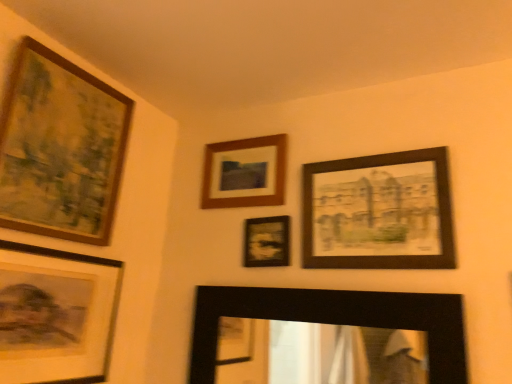
Find the location of a particular element. The height and width of the screenshot is (384, 512). black matte mirror at lower center, the 2th picture frame when ordered from right to left is located at coordinates (334, 320).

In order to click on wooden framed print at upper right, which appears as the sixth picture frame when viewed from the left in this screenshot , I will do `click(379, 212)`.

Identify the location of black matte mirror at lower center, which appears as the 5th picture frame when viewed from the left. The width and height of the screenshot is (512, 384). click(x=334, y=320).

Looking at this image, measure the distance between wooden-framed painting at upper left, the 6th picture frame from the right, and matte black picture frame at center, placed as the third picture frame when sorted from right to left.

wooden-framed painting at upper left, the 6th picture frame from the right, and matte black picture frame at center, placed as the third picture frame when sorted from right to left, are 64.95 centimeters apart from each other.

In the image, is wooden-framed painting at upper left, the 6th picture frame from the right, on the left side or the right side of matte black picture frame at center, placed as the third picture frame when sorted from right to left?

wooden-framed painting at upper left, the 6th picture frame from the right, is positioned on matte black picture frame at center, placed as the third picture frame when sorted from right to left,'s left side.

Based on their sizes in the image, would you say wooden-framed painting at upper left, the 6th picture frame from the right, is bigger or smaller than matte black picture frame at center, placed as the third picture frame when sorted from right to left?

wooden-framed painting at upper left, the 6th picture frame from the right, is bigger than matte black picture frame at center, placed as the third picture frame when sorted from right to left.

Considering the relative sizes of wooden-framed painting at upper left, the 6th picture frame from the right, and matte black picture frame at center, positioned as the fourth picture frame in left-to-right order, in the image provided, is wooden-framed painting at upper left, the 6th picture frame from the right, shorter than matte black picture frame at center, positioned as the fourth picture frame in left-to-right order,?

Incorrect, the height of wooden-framed painting at upper left, the 6th picture frame from the right, does not fall short of that of matte black picture frame at center, positioned as the fourth picture frame in left-to-right order.

In terms of width, does black matte mirror at lower center, the 2th picture frame when ordered from right to left, look wider or thinner when compared to wooden framed print at upper right, arranged as the 1th picture frame when viewed from the right?

black matte mirror at lower center, the 2th picture frame when ordered from right to left, is wider than wooden framed print at upper right, arranged as the 1th picture frame when viewed from the right.

Looking at this image, can you tell me how much black matte mirror at lower center, which appears as the 5th picture frame when viewed from the left, and wooden framed print at upper right, which appears as the sixth picture frame when viewed from the left, differ in facing direction?

There is a 0.0134-degree angle between the facing directions of black matte mirror at lower center, which appears as the 5th picture frame when viewed from the left, and wooden framed print at upper right, which appears as the sixth picture frame when viewed from the left.

I want to click on the 3rd picture frame below the wooden framed print at upper right, arranged as the 1th picture frame when viewed from the right (from the image's perspective), so click(334, 320).

Is black matte mirror at lower center, the 2th picture frame when ordered from right to left, smaller than wooden framed print at upper right, which appears as the sixth picture frame when viewed from the left?

Actually, black matte mirror at lower center, the 2th picture frame when ordered from right to left, might be larger than wooden framed print at upper right, which appears as the sixth picture frame when viewed from the left.

From their relative heights in the image, would you say wooden framed print at upper right, which appears as the sixth picture frame when viewed from the left, is taller or shorter than matte black picture frame at lower left, which appears as the 5th picture frame when viewed from the right?

In the image, wooden framed print at upper right, which appears as the sixth picture frame when viewed from the left, appears to be shorter than matte black picture frame at lower left, which appears as the 5th picture frame when viewed from the right.

Between wooden framed print at upper right, which appears as the sixth picture frame when viewed from the left, and matte black picture frame at lower left, placed as the second picture frame when sorted from left to right, which one appears on the right side from the viewer's perspective?

wooden framed print at upper right, which appears as the sixth picture frame when viewed from the left.

I want to click on the 3rd picture frame in front of the wooden framed print at upper right, which appears as the sixth picture frame when viewed from the left, so click(x=56, y=314).

From the image's perspective, is wooden framed print at upper right, arranged as the 1th picture frame when viewed from the right, beneath matte black picture frame at lower left, which appears as the 5th picture frame when viewed from the right?

No, from the image's perspective, wooden framed print at upper right, arranged as the 1th picture frame when viewed from the right, is not beneath matte black picture frame at lower left, which appears as the 5th picture frame when viewed from the right.

Looking at this image, how distant is black matte mirror at lower center, the 2th picture frame when ordered from right to left, from wooden frame at upper center, which is the 4th picture frame in right-to-left order?

They are 17.38 inches apart.

From the image's perspective, is black matte mirror at lower center, the 2th picture frame when ordered from right to left, positioned above or below wooden frame at upper center, which is the 4th picture frame in right-to-left order?

From the image's perspective, black matte mirror at lower center, the 2th picture frame when ordered from right to left, appears below wooden frame at upper center, which is the 4th picture frame in right-to-left order.

Which of these two, black matte mirror at lower center, which appears as the 5th picture frame when viewed from the left, or wooden frame at upper center, which is the 3th picture frame in left-to-right order, is wider?

Wider between the two is black matte mirror at lower center, which appears as the 5th picture frame when viewed from the left.

Is black matte mirror at lower center, which appears as the 5th picture frame when viewed from the left, with wooden frame at upper center, which is the 3th picture frame in left-to-right order?

There is a gap between black matte mirror at lower center, which appears as the 5th picture frame when viewed from the left, and wooden frame at upper center, which is the 3th picture frame in left-to-right order.

Is matte black picture frame at center, placed as the third picture frame when sorted from right to left, oriented away from black matte mirror at lower center, the 2th picture frame when ordered from right to left?

No.

From the image's perspective, which one is positioned lower, matte black picture frame at center, placed as the third picture frame when sorted from right to left, or black matte mirror at lower center, the 2th picture frame when ordered from right to left?

black matte mirror at lower center, the 2th picture frame when ordered from right to left, is shown below in the image.

From a real-world perspective, count 2nd picture frames downward from the matte black picture frame at center, placed as the third picture frame when sorted from right to left, and point to it. Please provide its 2D coordinates.

[(334, 320)]

Can you confirm if matte black picture frame at center, placed as the third picture frame when sorted from right to left, is taller than black matte mirror at lower center, which appears as the 5th picture frame when viewed from the left?

No, matte black picture frame at center, placed as the third picture frame when sorted from right to left, is not taller than black matte mirror at lower center, which appears as the 5th picture frame when viewed from the left.

Can you confirm if wooden frame at upper center, which is the 3th picture frame in left-to-right order, is positioned to the left of wooden-framed painting at upper left, arranged as the 1th picture frame when viewed from the left?

In fact, wooden frame at upper center, which is the 3th picture frame in left-to-right order, is to the right of wooden-framed painting at upper left, arranged as the 1th picture frame when viewed from the left.

Can you tell me how much wooden frame at upper center, which is the 3th picture frame in left-to-right order, and wooden-framed painting at upper left, the 6th picture frame from the right, differ in facing direction?

90.1 degrees separate the facing orientations of wooden frame at upper center, which is the 3th picture frame in left-to-right order, and wooden-framed painting at upper left, the 6th picture frame from the right.

Is wooden frame at upper center, which is the 4th picture frame in right-to-left order, oriented towards wooden-framed painting at upper left, arranged as the 1th picture frame when viewed from the left?

Yes.

From the image's perspective, which is below, wooden frame at upper center, which is the 3th picture frame in left-to-right order, or wooden-framed painting at upper left, arranged as the 1th picture frame when viewed from the left?

wooden frame at upper center, which is the 3th picture frame in left-to-right order, is shown below in the image.

Looking at this image, could you tell me if black matte mirror at lower center, the 2th picture frame when ordered from right to left, is facing matte black picture frame at lower left, placed as the second picture frame when sorted from left to right?

Yes, black matte mirror at lower center, the 2th picture frame when ordered from right to left, is turned towards matte black picture frame at lower left, placed as the second picture frame when sorted from left to right.

How many degrees apart are the facing directions of black matte mirror at lower center, which appears as the 5th picture frame when viewed from the left, and matte black picture frame at lower left, placed as the second picture frame when sorted from left to right?

They differ by 90 degrees in their facing directions.

Find the location of a particular element. The width and height of the screenshot is (512, 384). picture frame that is under the matte black picture frame at lower left, placed as the second picture frame when sorted from left to right (from a real-world perspective) is located at coordinates (334, 320).

Identify the location of the 2nd picture frame in front when counting from the matte black picture frame at center, placed as the third picture frame when sorted from right to left. The height and width of the screenshot is (384, 512). (60, 148).

From the image's perspective, starting from the black matte mirror at lower center, which appears as the 5th picture frame when viewed from the left, which picture frame is the 3rd one above? Please provide its 2D coordinates.

[(379, 212)]

Consider the image. Which object lies nearer to the anchor point matte black picture frame at lower left, placed as the second picture frame when sorted from left to right, matte black picture frame at center, placed as the third picture frame when sorted from right to left, or wooden frame at upper center, which is the 3th picture frame in left-to-right order?

matte black picture frame at center, placed as the third picture frame when sorted from right to left, lies closer to matte black picture frame at lower left, placed as the second picture frame when sorted from left to right, than the other object.

From the image, which object appears to be farther from wooden framed print at upper right, arranged as the 1th picture frame when viewed from the right, wooden-framed painting at upper left, arranged as the 1th picture frame when viewed from the left, or wooden frame at upper center, which is the 4th picture frame in right-to-left order?

The object further to wooden framed print at upper right, arranged as the 1th picture frame when viewed from the right, is wooden-framed painting at upper left, arranged as the 1th picture frame when viewed from the left.

Looking at the image, which one is located closer to wooden frame at upper center, which is the 4th picture frame in right-to-left order, wooden-framed painting at upper left, the 6th picture frame from the right, or wooden framed print at upper right, which appears as the sixth picture frame when viewed from the left?

Based on the image, wooden framed print at upper right, which appears as the sixth picture frame when viewed from the left, appears to be nearer to wooden frame at upper center, which is the 4th picture frame in right-to-left order.

Considering their positions, is wooden-framed painting at upper left, arranged as the 1th picture frame when viewed from the left, positioned closer to wooden frame at upper center, which is the 4th picture frame in right-to-left order, than matte black picture frame at lower left, placed as the second picture frame when sorted from left to right?

Answer: The object closer to wooden frame at upper center, which is the 4th picture frame in right-to-left order, is wooden-framed painting at upper left, arranged as the 1th picture frame when viewed from the left.

Looking at the image, which one is located closer to wooden frame at upper center, which is the 4th picture frame in right-to-left order, matte black picture frame at lower left, which appears as the 5th picture frame when viewed from the right, or black matte mirror at lower center, which appears as the 5th picture frame when viewed from the left?

black matte mirror at lower center, which appears as the 5th picture frame when viewed from the left.

Estimate the real-world distances between objects in this image. Which object is closer to wooden-framed painting at upper left, the 6th picture frame from the right, matte black picture frame at center, positioned as the fourth picture frame in left-to-right order, or black matte mirror at lower center, the 2th picture frame when ordered from right to left?

Among the two, matte black picture frame at center, positioned as the fourth picture frame in left-to-right order, is located nearer to wooden-framed painting at upper left, the 6th picture frame from the right.

Considering their positions, is black matte mirror at lower center, which appears as the 5th picture frame when viewed from the left, positioned closer to wooden frame at upper center, which is the 3th picture frame in left-to-right order, than matte black picture frame at center, placed as the third picture frame when sorted from right to left?

matte black picture frame at center, placed as the third picture frame when sorted from right to left.

Which object lies nearer to the anchor point wooden frame at upper center, which is the 4th picture frame in right-to-left order, wooden framed print at upper right, arranged as the 1th picture frame when viewed from the right, or wooden-framed painting at upper left, the 6th picture frame from the right?

wooden framed print at upper right, arranged as the 1th picture frame when viewed from the right, is closer to wooden frame at upper center, which is the 4th picture frame in right-to-left order.

Locate an element on the screen. picture frame situated between matte black picture frame at lower left, placed as the second picture frame when sorted from left to right, and matte black picture frame at center, placed as the third picture frame when sorted from right to left, from left to right is located at coordinates (245, 173).

Locate an element on the screen. This screenshot has width=512, height=384. picture frame located between wooden-framed painting at upper left, arranged as the 1th picture frame when viewed from the left, and wooden frame at upper center, which is the 4th picture frame in right-to-left order, in the left-right direction is located at coordinates (56, 314).